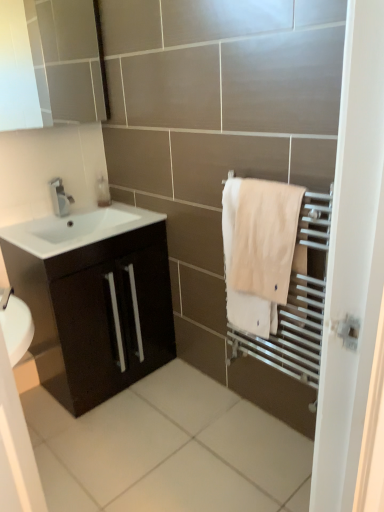
Question: Can you confirm if white glossy sink at lower left is taller than satin nickel faucet at upper left?

Choices:
 (A) no
 (B) yes

Answer: (A)

Question: Is white glossy sink at lower left touching satin nickel faucet at upper left?

Choices:
 (A) no
 (B) yes

Answer: (A)

Question: Is white glossy sink at lower left smaller than satin nickel faucet at upper left?

Choices:
 (A) no
 (B) yes

Answer: (A)

Question: Considering the relative sizes of white glossy sink at lower left and satin nickel faucet at upper left in the image provided, is white glossy sink at lower left wider than satin nickel faucet at upper left?

Choices:
 (A) yes
 (B) no

Answer: (A)

Question: Is the depth of white glossy sink at lower left greater than that of satin nickel faucet at upper left?

Choices:
 (A) yes
 (B) no

Answer: (B)

Question: Is satin nickel faucet at upper left in front of or behind white glossy sink at lower left in the image?

Choices:
 (A) behind
 (B) front

Answer: (A)

Question: Based on their sizes in the image, would you say satin nickel faucet at upper left is bigger or smaller than white glossy sink at lower left?

Choices:
 (A) small
 (B) big

Answer: (A)

Question: Is satin nickel faucet at upper left to the left or to the right of white glossy sink at lower left in the image?

Choices:
 (A) right
 (B) left

Answer: (B)

Question: From the image's perspective, is satin nickel faucet at upper left above or below white glossy sink at lower left?

Choices:
 (A) below
 (B) above

Answer: (B)

Question: From a real-world perspective, is white glossy sink at lower left above or below translucent plastic soap dispenser at upper left?

Choices:
 (A) below
 (B) above

Answer: (A)

Question: Considering the positions of point (109, 227) and point (109, 202), is point (109, 227) closer or farther from the camera than point (109, 202)?

Choices:
 (A) closer
 (B) farther

Answer: (A)

Question: From their relative heights in the image, would you say white glossy sink at lower left is taller or shorter than translucent plastic soap dispenser at upper left?

Choices:
 (A) short
 (B) tall

Answer: (A)

Question: In the image, is white glossy sink at lower left on the left side or the right side of translucent plastic soap dispenser at upper left?

Choices:
 (A) left
 (B) right

Answer: (A)

Question: From the image's perspective, is beige cotton towel at right above or below satin nickel faucet at upper left?

Choices:
 (A) above
 (B) below

Answer: (B)

Question: Is beige cotton towel at right taller or shorter than satin nickel faucet at upper left?

Choices:
 (A) tall
 (B) short

Answer: (A)